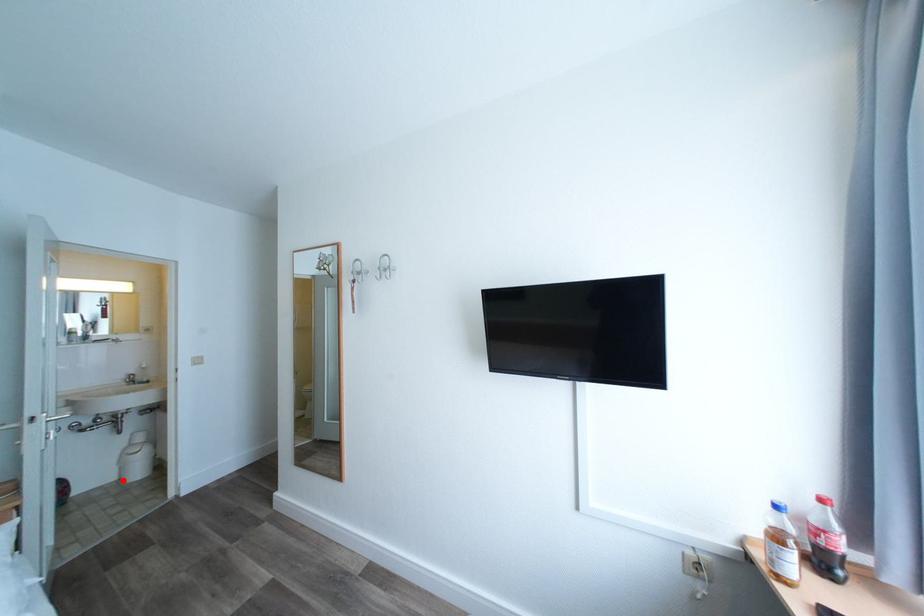
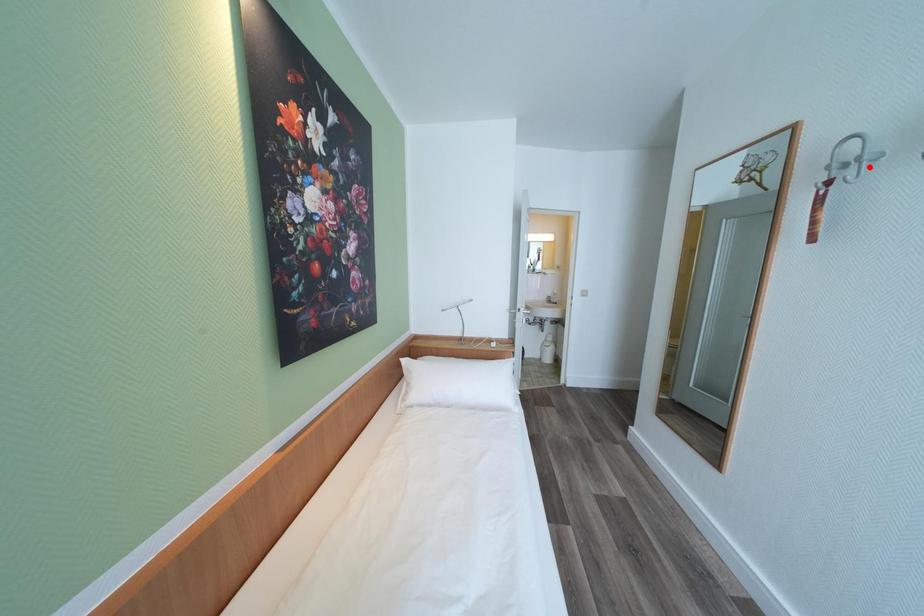
I am providing you with two images of the same scene from different viewpoints. A red point is marked on the first image and another point is marked on the second image. Do the highlighted points in image1 and image2 indicate the same real-world spot?

No